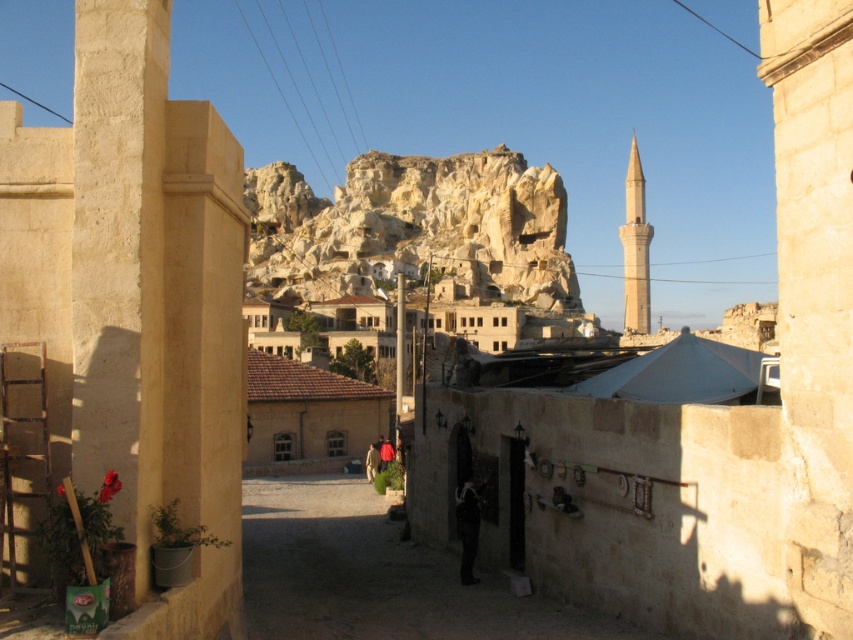
Based on the photo, you are a traveler in this historical area and want to pass through the smooth stone alley at center. There is a beige stone pillar at left blocking your path. Can you walk around it easily?

The beige stone pillar at left is thinner than the smooth stone alley at center, so yes, you can easily walk around it since the alley is wider than the pillar.